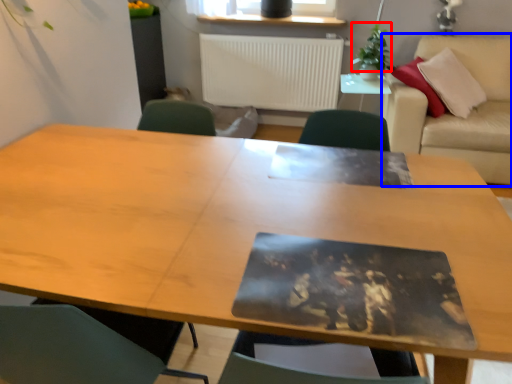
Question: Which object is further to the camera taking this photo, plant (highlighted by a red box) or couch (highlighted by a blue box)?

Choices:
 (A) plant
 (B) couch

Answer: (A)